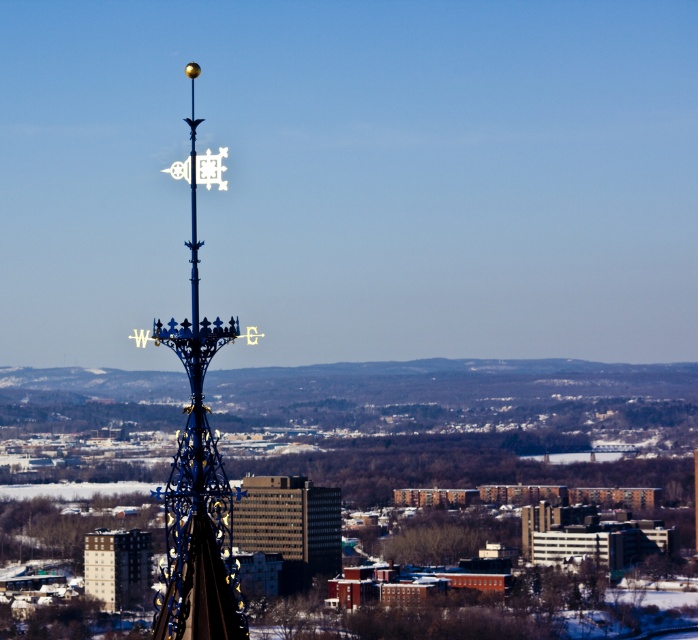
Is point (200, 468) less distant than point (252, 492)?

Yes, it is.

Which is more to the right, polished metal spire at center or brown brick building at center?

polished metal spire at center is more to the right.

Does point (184, 321) come closer to viewer compared to point (302, 552)?

Yes, it is.

In order to click on polished metal spire at center in this screenshot , I will do `click(198, 483)`.

Measure the distance between polished metal spire at center and camera.

They are 203.31 meters apart.

Between polished metal spire at center and metallic silver building at lower left, which one appears on the left side from the viewer's perspective?

Positioned to the left is metallic silver building at lower left.

You are a GUI agent. You are given a task and a screenshot of the screen. Output one action in this format:
    pyautogui.click(x=<x>, y=<y>)
    Task: Click on the polished metal spire at center
    
    Given the screenshot: What is the action you would take?
    pyautogui.click(x=198, y=483)

Who is positioned more to the right, brown brick building at center or metallic silver building at lower left?

From the viewer's perspective, brown brick building at center appears more on the right side.

Identify the location of brown brick building at center. (289, 525).

Identify the location of brown brick building at center. The image size is (698, 640). (289, 525).